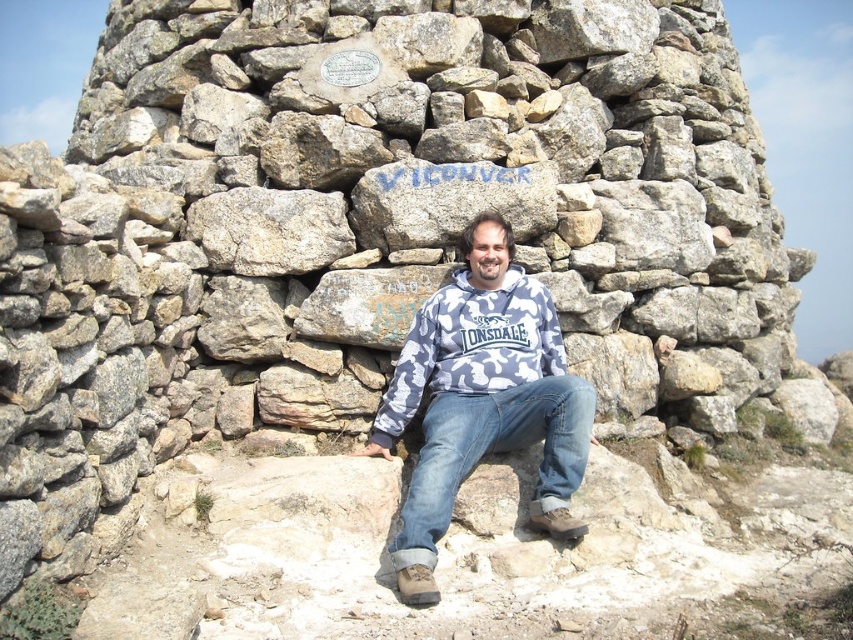
The user is trying to identify clothing items in the scene. They see two hoodies labeled as camouflage hoodie at center and camo fabric hoodie at center. Which one is positioned lower?

The camouflage hoodie at center is located below the camo fabric hoodie at center, so it is positioned lower.

Looking at this image, you are a photographer trying to capture the man in the image. You want to ensure both the camouflage hoodie at center and the blue denim jeans at center are clearly visible in the frame. Since you can only focus on one object at a time, which one should you focus on to ensure the other is also in focus?

The camouflage hoodie at center is bigger than blue denim jeans at center. Therefore, focusing on the camouflage hoodie at center will ensure the blue denim jeans at center is also in focus since it is smaller and within the same general area.

Where is the camouflage hoodie at center located in the image?

The camouflage hoodie at center is located at point (482, 400).